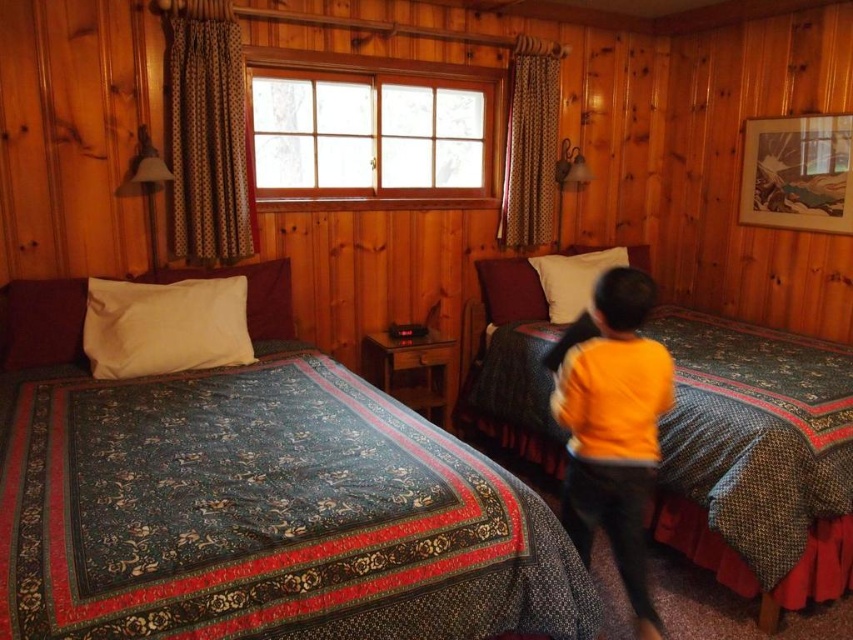
Question: Among these objects, which one is nearest to the camera?

Choices:
 (A) wooden window at center
 (B) white soft pillow at upper right
 (C) patterned fabric bed at center

Answer: (C)

Question: Is dark blue floral quilt at lower left in front of wooden window at center?

Choices:
 (A) yes
 (B) no

Answer: (A)

Question: Which point is closer to the camera?

Choices:
 (A) (184, 358)
 (B) (486, 124)
 (C) (688, 365)
 (D) (587, 253)

Answer: (A)

Question: Can you confirm if dark blue floral quilt at lower left is bigger than wooden window at center?

Choices:
 (A) yes
 (B) no

Answer: (A)

Question: Does wooden window at center appear on the right side of white soft pillow at left?

Choices:
 (A) yes
 (B) no

Answer: (A)

Question: Which point is closer to the camera?

Choices:
 (A) white soft pillow at left
 (B) wooden window at center
 (C) dark blue floral quilt at lower left
 (D) white soft pillow at upper right

Answer: (C)